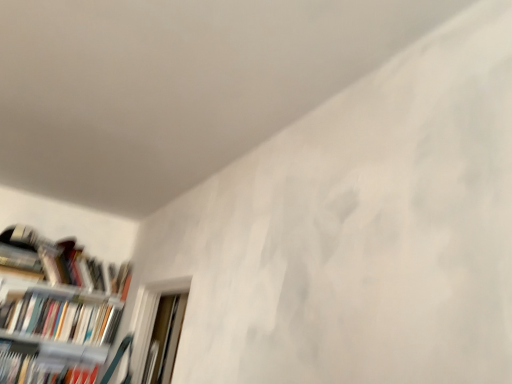
Question: From the image's perspective, relative to white plastic bookcase at lower left, is hardcover book at left, marked as the first book in a top-to-bottom arrangement, above or below?

Choices:
 (A) above
 (B) below

Answer: (A)

Question: Considering the positions of hardcover book at left, marked as the first book in a top-to-bottom arrangement, and white plastic bookcase at lower left in the image, is hardcover book at left, marked as the first book in a top-to-bottom arrangement, wider or thinner than white plastic bookcase at lower left?

Choices:
 (A) wide
 (B) thin

Answer: (B)

Question: Based on their relative distances, which object is nearer to the white glossy bookshelf at left, placed as the 2th book when sorted from bottom to top?

Choices:
 (A) hardcover book at lower left, the 1th book from the bottom
 (B) white plastic bookcase at lower left
 (C) hardcover book at left, marked as the first book in a top-to-bottom arrangement

Answer: (B)

Question: Based on their relative distances, which object is farther from the white glossy bookshelf at left, acting as the 2th book starting from the top?

Choices:
 (A) hardcover book at left, marked as the first book in a top-to-bottom arrangement
 (B) white plastic bookcase at lower left
 (C) hardcover book at lower left, the 1th book from the bottom

Answer: (C)